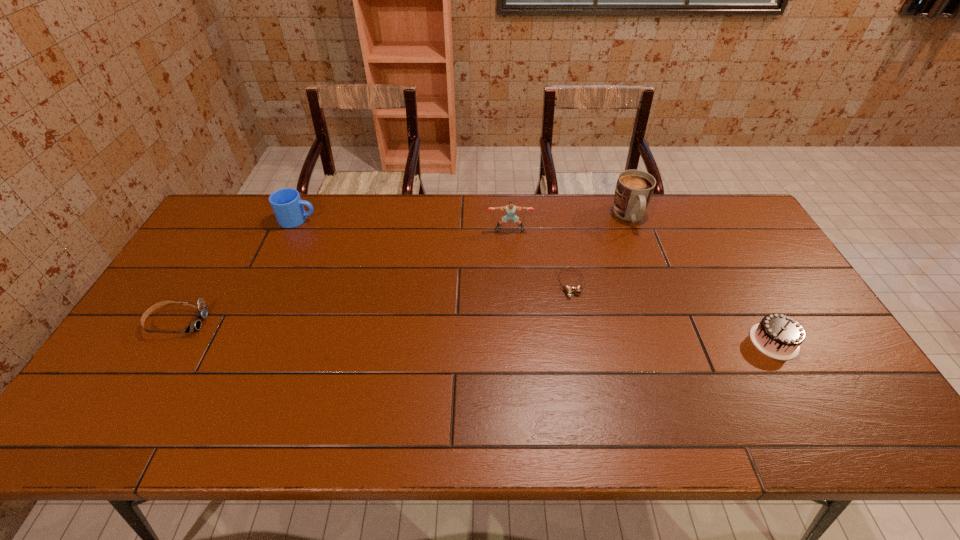
This screenshot has width=960, height=540. Identify the location of free space at the left edge. (208, 269).

Where is `vacant space at the right edge of the desktop`? This screenshot has width=960, height=540. vacant space at the right edge of the desktop is located at coordinates (736, 255).

Identify the location of free location at the far left corner of the desktop. (210, 227).

I want to click on empty location between the left goggles and the second object from right to left, so click(403, 269).

Where is `vacant space that is in between the second object from left to right and the taller mug`? The width and height of the screenshot is (960, 540). vacant space that is in between the second object from left to right and the taller mug is located at coordinates (464, 218).

Where is `unoccupied area between the fifth tallest object and the shorter mug`? Image resolution: width=960 pixels, height=540 pixels. unoccupied area between the fifth tallest object and the shorter mug is located at coordinates (237, 271).

At what (x,y) coordinates should I click in order to perform the action: click on free spot between the tallest object and the taller goggles. Please return your answer as a coordinate pair (x, y). The width and height of the screenshot is (960, 540). Looking at the image, I should click on (403, 269).

At what (x,y) coordinates should I click in order to perform the action: click on vacant region between the fourth object from right to left and the left mug. Please return your answer as a coordinate pair (x, y). The height and width of the screenshot is (540, 960). Looking at the image, I should click on (404, 225).

Locate an element on the screen. unoccupied position between the chocolate cake and the fifth tallest object is located at coordinates (475, 332).

Where is `free point between the fifth object from left to right and the second shortest object`? The height and width of the screenshot is (540, 960). free point between the fifth object from left to right and the second shortest object is located at coordinates (403, 269).